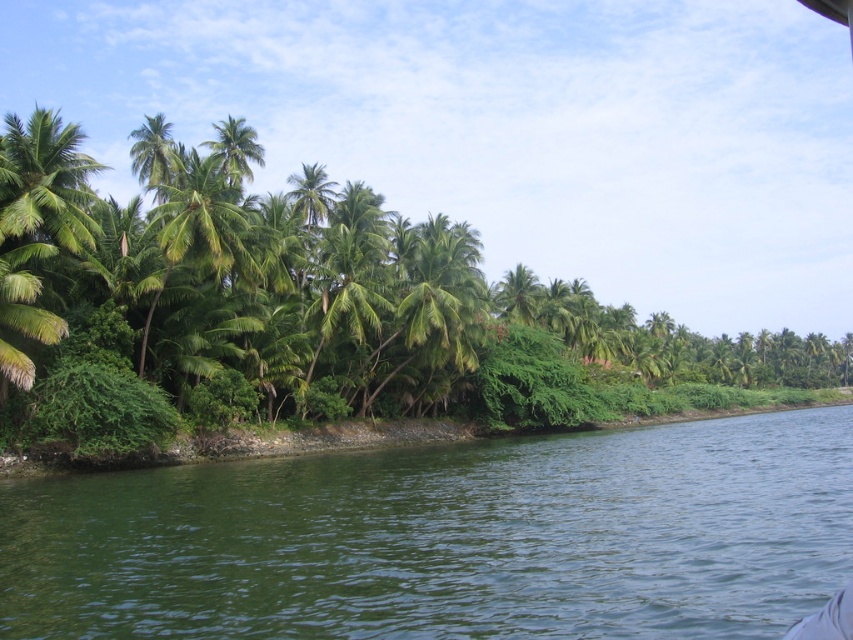
You are standing on the riverside path and want to take a photo of the green leafy palm tree at upper center and the green water at lower center. Which object should you focus on first if you want to capture both in a single frame without moving the camera?

You should focus on the green leafy palm tree at upper center first because it is closer to the camera than the green water at lower center, allowing both to be in the same frame.

You are standing at the edge of the tropical riverside scene. You see the green water at lower center and the green leafy palm tree at upper center. Which object is wider in this view?

The green leafy palm tree at upper center is wider than the green water at lower center.

You are standing at the riverside and want to take a photo of both the green water at lower center and the green leafy palm tree at upper center. Which object should you focus on first to ensure both are in sharp focus?

You should focus on the green leafy palm tree at upper center first because it is farther away than the green water at lower center, allowing the camera to capture both in focus.